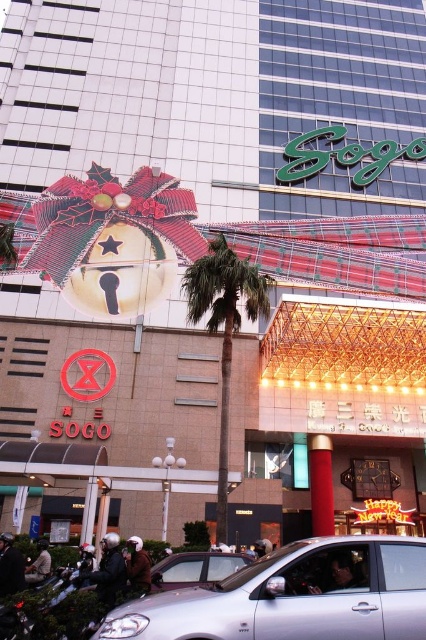
You are a delivery person trying to park your truck between the two silver metallic cars. The truck requires a 12 meter space. Based on the scene, do you think there is enough space between the silver metallic car at lower center and the silver metallic car at center?

The silver metallic car at lower center is 11.36 meters from the silver metallic car at center. Since the truck requires 12 meters, there is not enough space between them to park the truck.

You are a delivery driver who needs to park your truck in the parking lot behind the building. The parking lot has a loading zone marked with the green leafy palm tree at center and the silver metallic car at center. Which object should you avoid parking near to ensure your truck fits properly?

The green leafy palm tree at center is positioned over the silver metallic car at center, so you should avoid parking near the green leafy palm tree at center because it is located above the car and might obstruct the parking space.